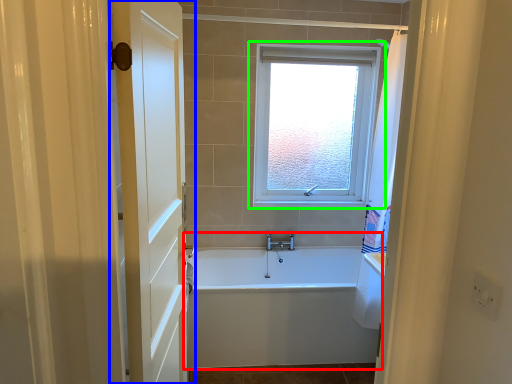
Question: Based on their relative distances, which object is nearer to bathtub (highlighted by a red box)? Choose from door (highlighted by a blue box) and window (highlighted by a green box).

Choices:
 (A) door
 (B) window

Answer: (A)